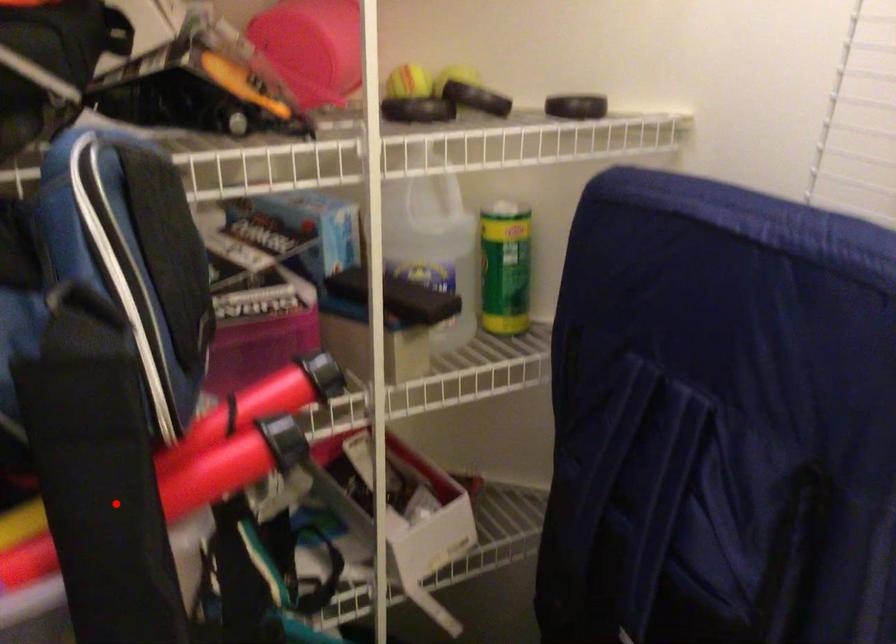
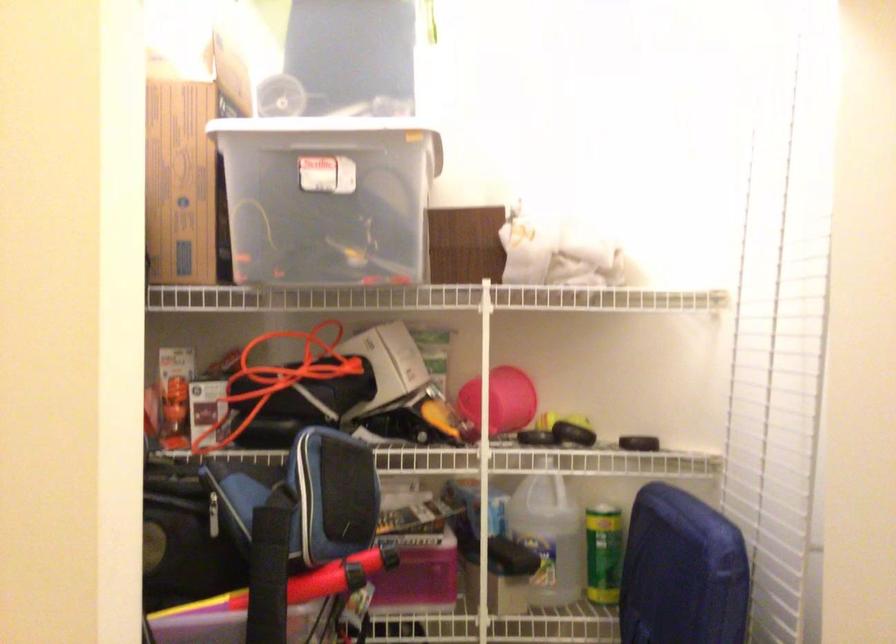
Where in the second image is the point corresponding to the highlighted location from the first image?

(269, 574)